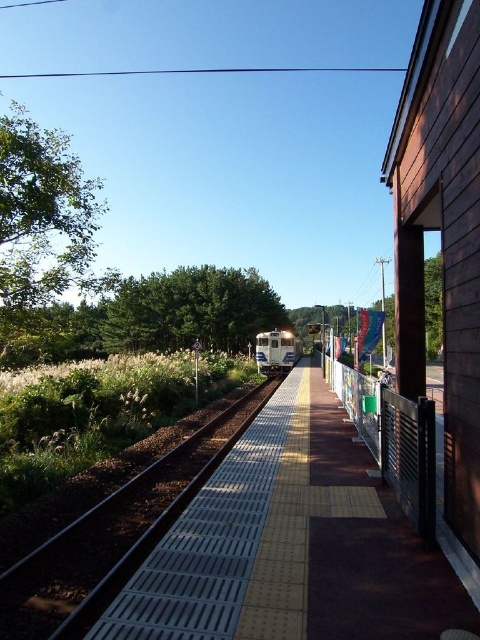
You are a passenger waiting on the yellow textured platform at center. You see the metallic silver train track at center ahead of you. If the train arrives on the track, will you be able to board it easily?

The yellow textured platform at center is in front of the metallic silver train track at center, so the platform is positioned directly in front of the track. This means you can easily board the train as it arrives on the track since the platform is right where the track is located.

You are a passenger waiting on the yellow textured platform at center. You see the metallic silver train track at center ahead of you. In which direction is the track located relative to the platform?

The metallic silver train track at center is on the left side of the yellow textured platform at center, as the platform is positioned to the right of the track.